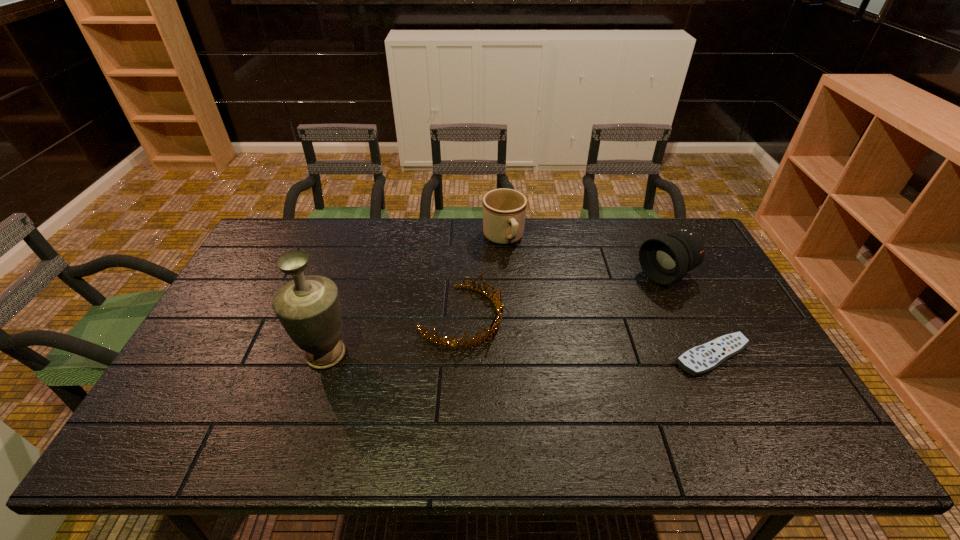
The image size is (960, 540). I want to click on free space located 0.210m on the side of the farthest object with the handle, so click(x=530, y=298).

Image resolution: width=960 pixels, height=540 pixels. In order to click on free space located at the front element of the telephoto lens in this screenshot , I will do `click(544, 338)`.

At what (x,y) coordinates should I click in order to perform the action: click on vacant point located at the front element of the telephoto lens. Please return your answer as a coordinate pair (x, y). Image resolution: width=960 pixels, height=540 pixels. Looking at the image, I should click on (588, 315).

Image resolution: width=960 pixels, height=540 pixels. Identify the location of blank space located 0.080m at the front element of the telephoto lens. (627, 295).

You are a GUI agent. You are given a task and a screenshot of the screen. Output one action in this format:
    pyautogui.click(x=<x>, y=<y>)
    Task: Click on the free space located 0.130m on the front-facing side of the fourth tallest object
    The image size is (960, 540).
    Given the screenshot: What is the action you would take?
    pyautogui.click(x=540, y=353)

I want to click on vacant space situated on the front-facing side of the fourth tallest object, so click(x=578, y=369).

At what (x,y) coordinates should I click in order to perform the action: click on vacant space located 0.300m on the front-facing side of the fourth tallest object. Please return your answer as a coordinate pair (x, y). The width and height of the screenshot is (960, 540). Looking at the image, I should click on [x=601, y=380].

Locate an element on the screen. This screenshot has width=960, height=540. mug that is at the far edge is located at coordinates (504, 210).

Find the location of a particular element. telephoto lens that is at the far edge is located at coordinates (665, 258).

You are a GUI agent. You are given a task and a screenshot of the screen. Output one action in this format:
    pyautogui.click(x=<x>, y=<y>)
    Task: Click on the remote control at the right edge
    This screenshot has width=960, height=540.
    Given the screenshot: What is the action you would take?
    (699, 360)